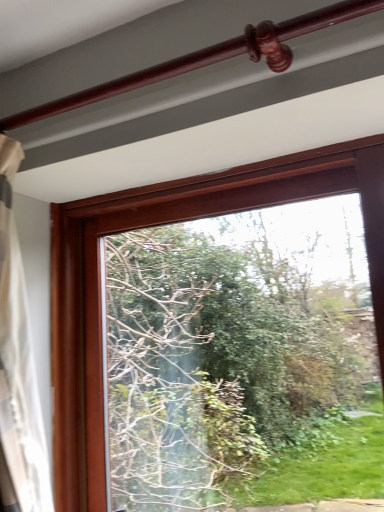
Question: From the image's perspective, is glossy wood rail at upper center below transparent glass window at center?

Choices:
 (A) no
 (B) yes

Answer: (A)

Question: Is glossy wood rail at upper center oriented away from transparent glass window at center?

Choices:
 (A) no
 (B) yes

Answer: (A)

Question: Considering the relative sizes of glossy wood rail at upper center and transparent glass window at center in the image provided, is glossy wood rail at upper center bigger than transparent glass window at center?

Choices:
 (A) yes
 (B) no

Answer: (B)

Question: Is glossy wood rail at upper center outside transparent glass window at center?

Choices:
 (A) no
 (B) yes

Answer: (B)

Question: From a real-world perspective, is glossy wood rail at upper center positioned under transparent glass window at center based on gravity?

Choices:
 (A) no
 (B) yes

Answer: (A)

Question: From a real-world perspective, is glossy wood rail at upper center physically above transparent glass window at center?

Choices:
 (A) no
 (B) yes

Answer: (B)

Question: From the image's perspective, does transparent glass window at center appear lower than glossy wood rail at upper center?

Choices:
 (A) no
 (B) yes

Answer: (B)

Question: Considering the relative sizes of transparent glass window at center and glossy wood rail at upper center in the image provided, is transparent glass window at center thinner than glossy wood rail at upper center?

Choices:
 (A) yes
 (B) no

Answer: (B)

Question: Considering the relative sizes of transparent glass window at center and glossy wood rail at upper center in the image provided, is transparent glass window at center wider than glossy wood rail at upper center?

Choices:
 (A) no
 (B) yes

Answer: (B)

Question: Could glossy wood rail at upper center be considered to be inside transparent glass window at center?

Choices:
 (A) yes
 (B) no

Answer: (B)

Question: Can you confirm if transparent glass window at center is shorter than glossy wood rail at upper center?

Choices:
 (A) no
 (B) yes

Answer: (A)

Question: Considering the relative positions of transparent glass window at center and glossy wood rail at upper center in the image provided, is transparent glass window at center to the left of glossy wood rail at upper center from the viewer's perspective?

Choices:
 (A) no
 (B) yes

Answer: (A)

Question: Looking at the image, does transparent glass window at center seem bigger or smaller compared to glossy wood rail at upper center?

Choices:
 (A) big
 (B) small

Answer: (A)